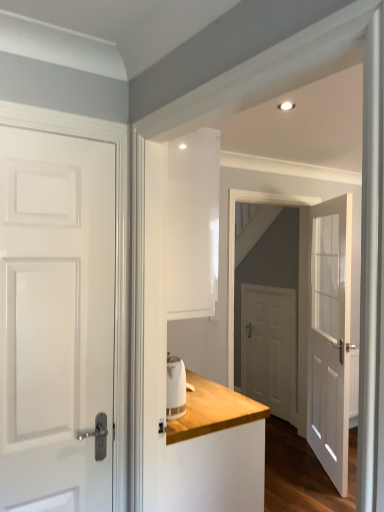
Where is `free spot above white glossy door at left, the third door from the back (from a real-world perspective)`? free spot above white glossy door at left, the third door from the back (from a real-world perspective) is located at coordinates (74, 133).